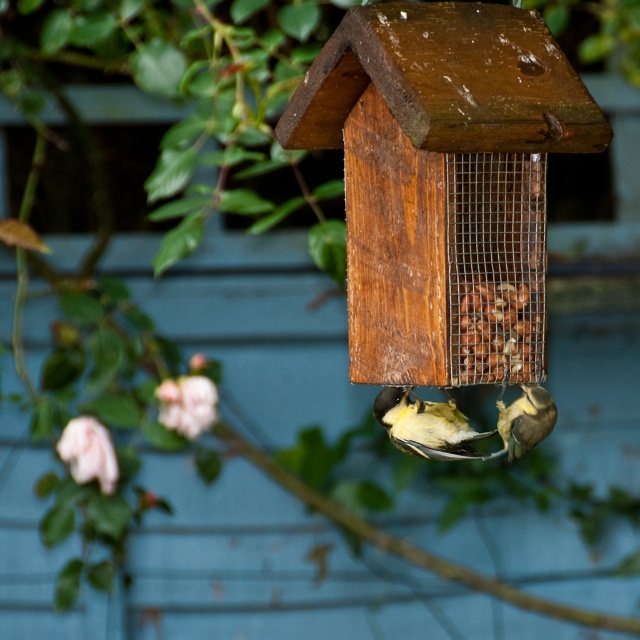
Question: Among these objects, which one is nearest to the camera?

Choices:
 (A) brown matte nuts at center
 (B) yellow-green feathers at center
 (C) wooden bird feeder at center

Answer: (C)

Question: Does yellow matte bird at center appear over yellow-green feathers at center?

Choices:
 (A) no
 (B) yes

Answer: (B)

Question: Does wooden bird feeder at center appear under yellow matte bird at center?

Choices:
 (A) no
 (B) yes

Answer: (A)

Question: In this image, where is yellow matte bird at center located relative to yellow-green feathers at center?

Choices:
 (A) right
 (B) left

Answer: (B)

Question: Among these points, which one is farthest from the camera?

Choices:
 (A) (515, 422)
 (B) (477, 314)

Answer: (A)

Question: Estimate the real-world distances between objects in this image. Which object is farther from the wooden bird feeder at center?

Choices:
 (A) brown matte nuts at center
 (B) yellow matte bird at center
 (C) yellow-green feathers at center

Answer: (C)